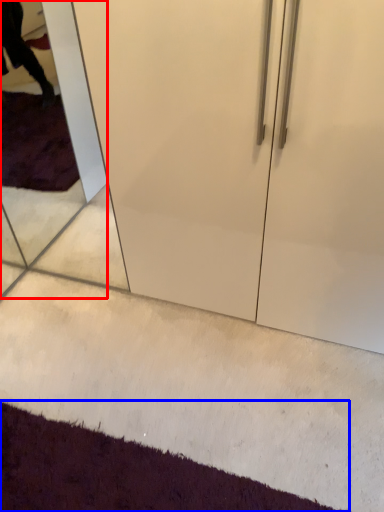
Question: Which object appears closest to the camera in this image, glass door (highlighted by a red box) or doormat (highlighted by a blue box)?

Choices:
 (A) glass door
 (B) doormat

Answer: (B)